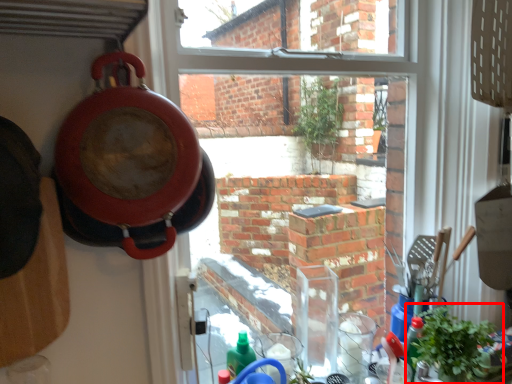
Question: Observing the image, what is the correct spatial positioning of houseplant (annotated by the red box) in reference to pizza pan?

Choices:
 (A) right
 (B) left

Answer: (A)